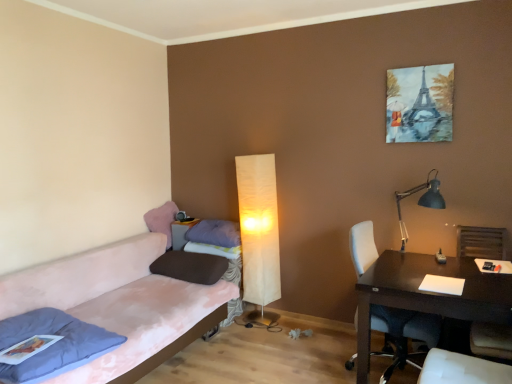
Question: In terms of width, does matte cream floor lamp at center, which is the first lamp in left-to-right order, look wider or thinner when compared to matte gray side table at lower left?

Choices:
 (A) wide
 (B) thin

Answer: (B)

Question: Is matte cream floor lamp at center, which is the first lamp in left-to-right order, taller or shorter than matte gray side table at lower left?

Choices:
 (A) tall
 (B) short

Answer: (A)

Question: Considering the real-world distances, which object is closest to the white leather armchair at right?

Choices:
 (A) acrylic painting of eiffel tower at upper right
 (B) pink fabric couch at left
 (C) blue matte desk lamp at right, the first lamp in the right-to-left sequence
 (D) matte gray side table at lower left
 (E) blue fabric pillow at lower left, the first pillow in the front-to-back sequence

Answer: (C)

Question: Which of these objects is positioned farthest from the dark wood desk at right?

Choices:
 (A) blue fabric pillow at lower left, which is the fourth pillow in back-to-front order
 (B) brown matte pillow at center, which is counted as the second pillow, starting from the front
 (C) acrylic painting of eiffel tower at upper right
 (D) purple soft pillow at center, which ranks as the 2th pillow in back-to-front order
 (E) white leather chair at right

Answer: (A)